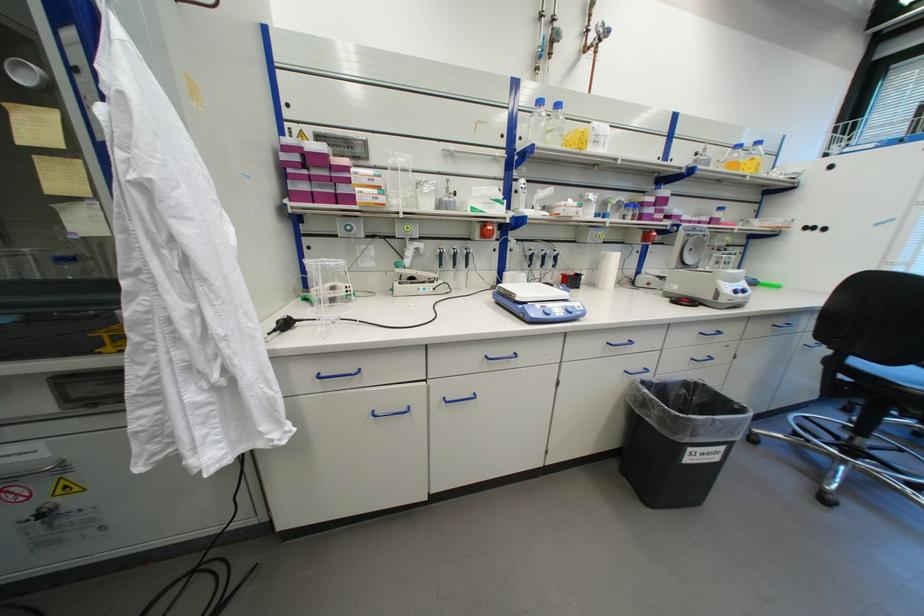
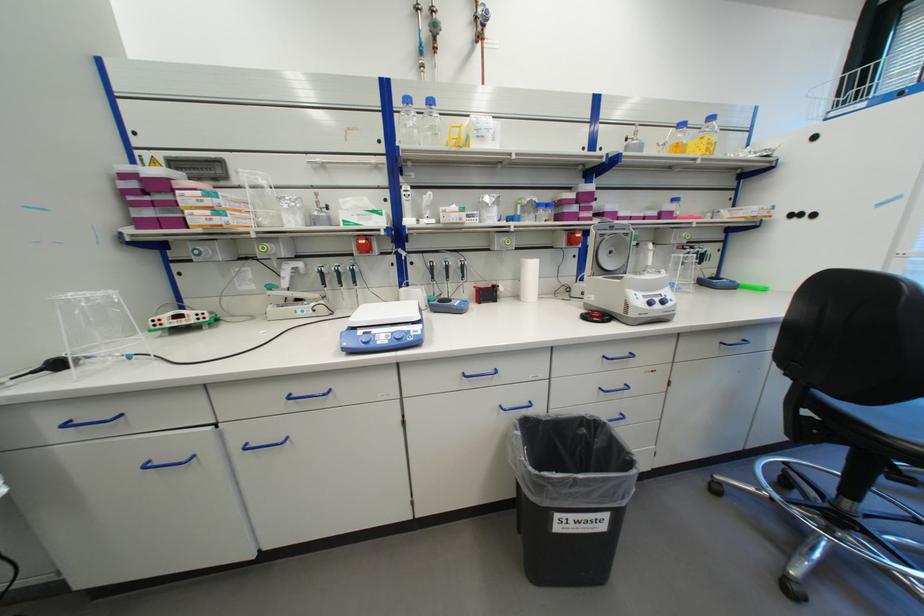
The point at (x=659, y=233) is marked in the first image. Where is the corresponding point in the second image?

(581, 235)